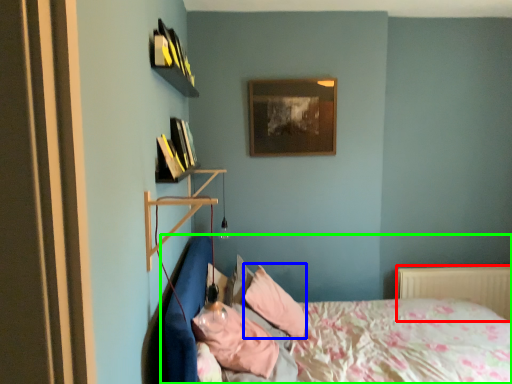
Question: Considering the real-world distances, which object is closest to radiator (highlighted by a red box)? pillow (highlighted by a blue box) or bed (highlighted by a green box).

Choices:
 (A) pillow
 (B) bed

Answer: (B)